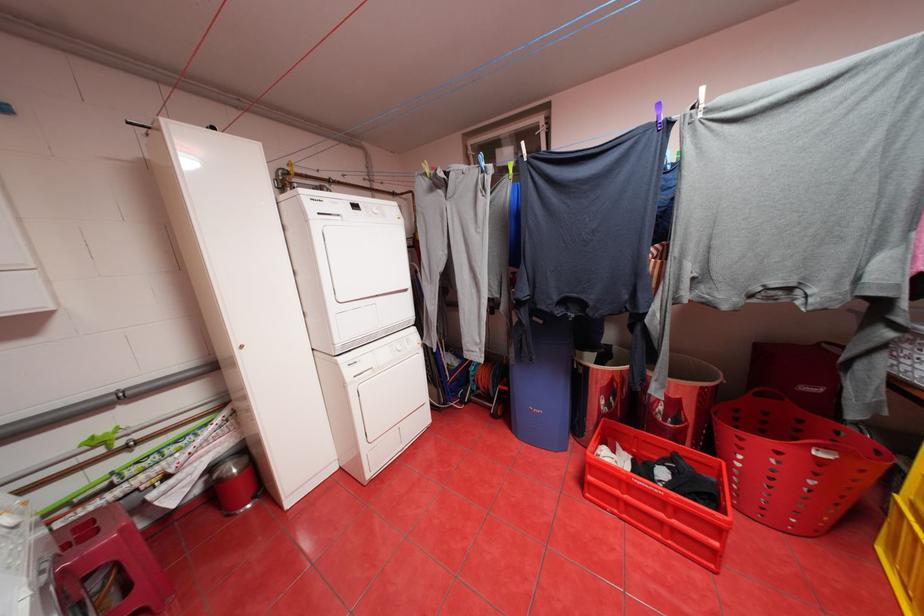
Where is `silver cabinet knob`? silver cabinet knob is located at coordinates (240, 346).